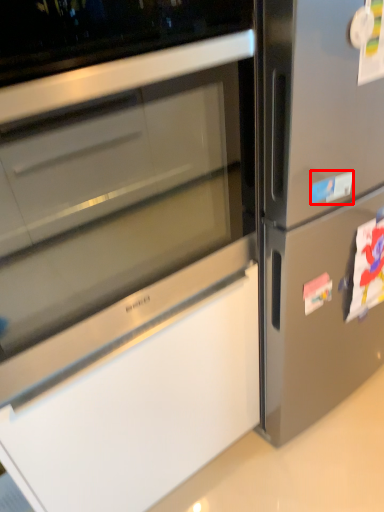
Question: From the image's perspective, considering the relative positions of sticker (annotated by the red box) and sticker in the image provided, where is sticker (annotated by the red box) located with respect to the staircase?

Choices:
 (A) above
 (B) below

Answer: (A)